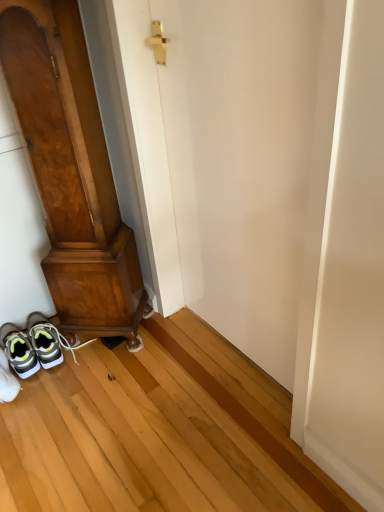
Question: Is wooden door at left, the first door from the left, closer to camera compared to white matte sneakers at lower left, which ranks as the 2th footwear in front-to-back order?

Choices:
 (A) yes
 (B) no

Answer: (A)

Question: Is wooden door at left, the first door from the left, behind white matte sneakers at lower left, which ranks as the 2th footwear in front-to-back order?

Choices:
 (A) no
 (B) yes

Answer: (A)

Question: Is wooden door at left, the second door in the right-to-left sequence, bigger than white matte sneakers at lower left, which is counted as the 1th footwear, starting from the back?

Choices:
 (A) no
 (B) yes

Answer: (B)

Question: From a real-world perspective, is wooden door at left, the first door from the left, positioned under white matte sneakers at lower left, which ranks as the 2th footwear in front-to-back order, based on gravity?

Choices:
 (A) no
 (B) yes

Answer: (A)

Question: Does wooden door at left, the first door from the left, have a smaller size compared to white matte sneakers at lower left, which is counted as the 1th footwear, starting from the back?

Choices:
 (A) yes
 (B) no

Answer: (B)

Question: Is point (311, 294) closer or farther from the camera than point (36, 324)?

Choices:
 (A) closer
 (B) farther

Answer: (A)

Question: In terms of size, does white smooth door at center, which ranks as the 2th door in left-to-right order, appear bigger or smaller than white matte sneakers at lower left, which is counted as the 1th footwear, starting from the back?

Choices:
 (A) small
 (B) big

Answer: (B)

Question: From a real-world perspective, is white smooth door at center, which ranks as the 2th door in left-to-right order, physically located above or below white matte sneakers at lower left, which ranks as the 2th footwear in front-to-back order?

Choices:
 (A) above
 (B) below

Answer: (A)

Question: Is white smooth door at center, which ranks as the 2th door in left-to-right order, wider or thinner than white matte sneakers at lower left, which is counted as the 1th footwear, starting from the back?

Choices:
 (A) thin
 (B) wide

Answer: (A)

Question: Is point (238, 131) positioned closer to the camera than point (84, 76)?

Choices:
 (A) farther
 (B) closer

Answer: (B)

Question: Considering the relative positions of white smooth door at center, which ranks as the 2th door in left-to-right order, and wooden door at left, the second door in the right-to-left sequence, in the image provided, is white smooth door at center, which ranks as the 2th door in left-to-right order, to the left or to the right of wooden door at left, the second door in the right-to-left sequence,?

Choices:
 (A) right
 (B) left

Answer: (A)

Question: From the image's perspective, is white smooth door at center, which ranks as the 1th door in right-to-left order, positioned above or below wooden door at left, the second door in the right-to-left sequence?

Choices:
 (A) above
 (B) below

Answer: (B)

Question: In terms of height, does white smooth door at center, which ranks as the 1th door in right-to-left order, look taller or shorter compared to wooden door at left, the first door from the left?

Choices:
 (A) tall
 (B) short

Answer: (B)

Question: Is white matte sneakers at lower left, which is counted as the 1th footwear, starting from the back, in front of or behind white mesh sneakers at lower left, marked as the 2th footwear in a back-to-front arrangement, in the image?

Choices:
 (A) behind
 (B) front

Answer: (A)

Question: From their relative heights in the image, would you say white matte sneakers at lower left, which ranks as the 2th footwear in front-to-back order, is taller or shorter than white mesh sneakers at lower left, marked as the 2th footwear in a back-to-front arrangement?

Choices:
 (A) tall
 (B) short

Answer: (B)